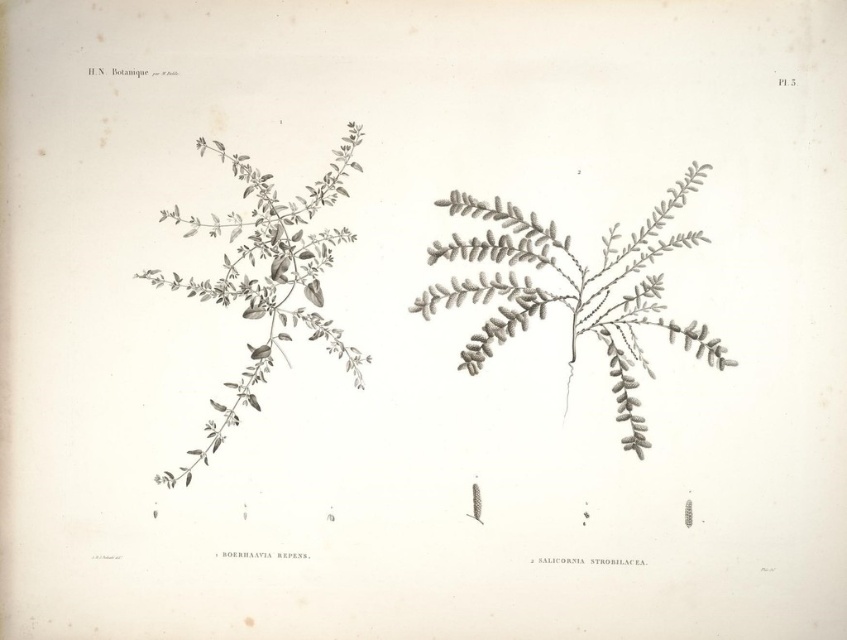
Question: Which point is closer to the camera?

Choices:
 (A) gray textured plant at center
 (B) gray textured plant at left

Answer: (A)

Question: Which point is farther from the camera taking this photo?

Choices:
 (A) (253, 384)
 (B) (472, 198)

Answer: (B)

Question: Does gray textured plant at center come behind gray textured plant at left?

Choices:
 (A) no
 (B) yes

Answer: (A)

Question: Can you confirm if gray textured plant at center is wider than gray textured plant at left?

Choices:
 (A) yes
 (B) no

Answer: (A)

Question: Which of the following is the closest to the observer?

Choices:
 (A) (645, 236)
 (B) (307, 308)

Answer: (A)

Question: Is gray textured plant at center in front of gray textured plant at left?

Choices:
 (A) yes
 (B) no

Answer: (A)